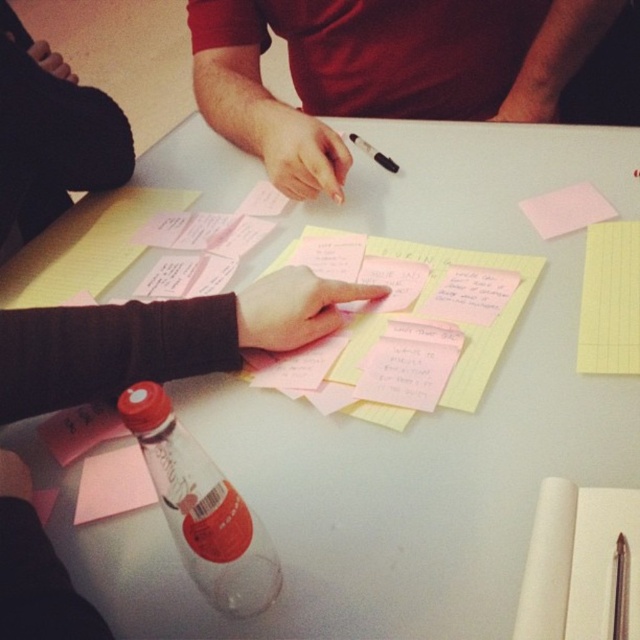
Question: Which is farther from the pink paper at center?

Choices:
 (A) pink paper at lower left
 (B) black glossy pen at center
 (C) metallic silver pen at upper right

Answer: (C)

Question: Can you confirm if white paper notepad at lower right is positioned to the left of pink paper at lower left?

Choices:
 (A) no
 (B) yes

Answer: (A)

Question: Is transparent plastic bottle at lower left above white paper notepad at lower right?

Choices:
 (A) no
 (B) yes

Answer: (B)

Question: Which of the following is the farthest from the observer?

Choices:
 (A) (529, 208)
 (B) (618, 627)
 (C) (330, 380)

Answer: (A)

Question: Which of these objects is positioned farthest from the white paper notepad at lower right?

Choices:
 (A) black glossy pen at center
 (B) matte red shirt at center
 (C) metallic silver pen at upper right

Answer: (B)

Question: Can you confirm if matte red shirt at center is wider than pink paper at lower left?

Choices:
 (A) yes
 (B) no

Answer: (A)